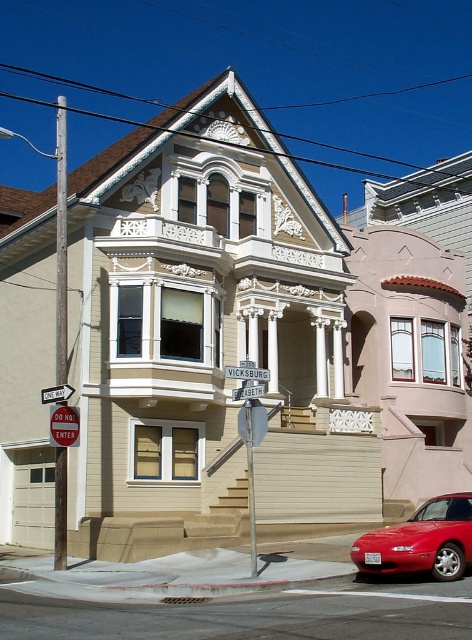
Does metallic pole at left have a lesser width compared to white metal street sign at upper center?

No.

Does metallic pole at left appear over white metal street sign at upper center?

Correct, metallic pole at left is located above white metal street sign at upper center.

Which is behind, point (61, 147) or point (244, 387)?

The point (61, 147) is more distant.

Locate an element on the screen. The image size is (472, 640). metallic pole at left is located at coordinates (60, 244).

Is red plastic stop sign at center smaller than white wooden street sign at upper center?

Indeed, red plastic stop sign at center has a smaller size compared to white wooden street sign at upper center.

Which is more to the right, red plastic stop sign at center or white wooden street sign at upper center?

white wooden street sign at upper center is more to the right.

Which is in front, point (64, 428) or point (229, 365)?

Point (64, 428)

I want to click on red plastic stop sign at center, so click(64, 426).

Measure the distance between shiny red car at lower right and metallic pole at left.

shiny red car at lower right is 17.25 meters from metallic pole at left.

Who is more distant from viewer, (420, 522) or (59, 145)?

The point (59, 145) is behind.

Identify the location of shiny red car at lower right. (421, 541).